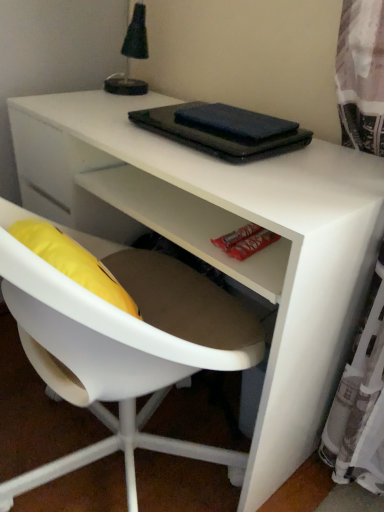
Where is `dark blue matte notebook at upper center, the second notebook positioned from the bottom`? dark blue matte notebook at upper center, the second notebook positioned from the bottom is located at coordinates (234, 123).

Where is `dark blue matte notebook at upper center, which appears as the first notebook when viewed from the top`? The width and height of the screenshot is (384, 512). dark blue matte notebook at upper center, which appears as the first notebook when viewed from the top is located at coordinates (234, 123).

Is dark blue matte notebook at upper center, which appears as the first notebook when viewed from the top, wider or thinner than black fabric lampshade at upper left?

Clearly, dark blue matte notebook at upper center, which appears as the first notebook when viewed from the top, has less width compared to black fabric lampshade at upper left.

From the image's perspective, is dark blue matte notebook at upper center, which appears as the first notebook when viewed from the top, located above black fabric lampshade at upper left?

No, from the image's perspective, dark blue matte notebook at upper center, which appears as the first notebook when viewed from the top, is not above black fabric lampshade at upper left.

Could you tell me if dark blue matte notebook at upper center, which appears as the first notebook when viewed from the top, is turned towards black fabric lampshade at upper left?

No, dark blue matte notebook at upper center, which appears as the first notebook when viewed from the top, is not facing towards black fabric lampshade at upper left.

Is dark blue matte notebook at upper center, the second notebook positioned from the bottom, closer to camera compared to black fabric lampshade at upper left?

Yes.

Which notebook is the 2nd one when counting from the right side of the white plastic chair at center? Please provide its 2D coordinates.

[(234, 123)]

Would you say dark blue matte notebook at upper center, which appears as the first notebook when viewed from the top, is inside or outside white plastic chair at center?

The correct answer is: inside.

Does dark blue matte notebook at upper center, which appears as the first notebook when viewed from the top, have a greater width compared to white plastic chair at center?

Incorrect, the width of dark blue matte notebook at upper center, which appears as the first notebook when viewed from the top, does not surpass that of white plastic chair at center.

Considering the relative sizes of dark blue matte notebook at upper center, which appears as the first notebook when viewed from the top, and white plastic chair at center in the image provided, is dark blue matte notebook at upper center, which appears as the first notebook when viewed from the top, taller than white plastic chair at center?

Incorrect, the height of dark blue matte notebook at upper center, which appears as the first notebook when viewed from the top, is not larger of that of white plastic chair at center.

Between white plastic chair at center and black fabric lampshade at upper left, which one has larger size?

white plastic chair at center.

Can you see white plastic chair at center touching black fabric lampshade at upper left?

They are not placed beside each other.

Which object is closer to the camera, white plastic chair at center or black fabric lampshade at upper left?

white plastic chair at center.

In the image, there is a white plastic chair at center. Identify the location of table lamp above it (from the image's perspective). coord(131,56).

Looking at this image, is white plastic chair at center situated inside black matte notebook at center, the 2th notebook positioned from the top, or outside?

The correct answer is: outside.

From the image's perspective, between white plastic chair at center and black matte notebook at center, which is the first notebook from bottom to top, who is located below?

white plastic chair at center, from the image's perspective.

Is white plastic chair at center facing away from black matte notebook at center, the 2th notebook positioned from the top?

No, white plastic chair at center's orientation is not away from black matte notebook at center, the 2th notebook positioned from the top.

Considering the relative sizes of white plastic chair at center and black matte notebook at center, the 2th notebook positioned from the top, in the image provided, is white plastic chair at center thinner than black matte notebook at center, the 2th notebook positioned from the top,?

Incorrect, the width of white plastic chair at center is not less than that of black matte notebook at center, the 2th notebook positioned from the top.

How many degrees apart are the facing directions of dark blue matte notebook at upper center, the second notebook positioned from the bottom, and black matte notebook at center, the 2th notebook positioned from the top?

0.257 degrees separate the facing orientations of dark blue matte notebook at upper center, the second notebook positioned from the bottom, and black matte notebook at center, the 2th notebook positioned from the top.

From the image's perspective, does dark blue matte notebook at upper center, the second notebook positioned from the bottom, appear lower than black matte notebook at center, which is the first notebook from bottom to top?

Actually, dark blue matte notebook at upper center, the second notebook positioned from the bottom, appears above black matte notebook at center, which is the first notebook from bottom to top, in the image.

Measure the distance from dark blue matte notebook at upper center, the second notebook positioned from the bottom, to black matte notebook at center, the 2th notebook positioned from the top.

dark blue matte notebook at upper center, the second notebook positioned from the bottom, and black matte notebook at center, the 2th notebook positioned from the top, are 1.45 centimeters apart.

Based on their positions, is dark blue matte notebook at upper center, the second notebook positioned from the bottom, located to the left or right of black matte notebook at center, which is the first notebook from bottom to top?

Based on their positions, dark blue matte notebook at upper center, the second notebook positioned from the bottom, is located to the right of black matte notebook at center, which is the first notebook from bottom to top.

Is white plastic chair at center turned away from dark blue matte notebook at upper center, the second notebook positioned from the bottom?

No.

From a real-world perspective, is white plastic chair at center positioned above or below dark blue matte notebook at upper center, which appears as the first notebook when viewed from the top?

From a real-world perspective, white plastic chair at center is physically below dark blue matte notebook at upper center, which appears as the first notebook when viewed from the top.

Considering the relative positions of white plastic chair at center and dark blue matte notebook at upper center, the second notebook positioned from the bottom, in the image provided, is white plastic chair at center behind dark blue matte notebook at upper center, the second notebook positioned from the bottom,?

No.

Is white plastic chair at center to the left or to the right of dark blue matte notebook at upper center, the second notebook positioned from the bottom, in the image?

In the image, white plastic chair at center appears on the left side of dark blue matte notebook at upper center, the second notebook positioned from the bottom.

How many degrees apart are the facing directions of black matte notebook at center, which is the first notebook from bottom to top, and black fabric lampshade at upper left?

There is a 40.9-degree angle between the facing directions of black matte notebook at center, which is the first notebook from bottom to top, and black fabric lampshade at upper left.

Is black matte notebook at center, which is the first notebook from bottom to top, with black fabric lampshade at upper left?

No, black matte notebook at center, which is the first notebook from bottom to top, is not with black fabric lampshade at upper left.

Considering their positions, is black matte notebook at center, which is the first notebook from bottom to top, located in front of or behind black fabric lampshade at upper left?

Clearly, black matte notebook at center, which is the first notebook from bottom to top, is in front of black fabric lampshade at upper left.

Considering the sizes of objects black matte notebook at center, which is the first notebook from bottom to top, and black fabric lampshade at upper left in the image provided, who is smaller, black matte notebook at center, which is the first notebook from bottom to top, or black fabric lampshade at upper left?

black matte notebook at center, which is the first notebook from bottom to top, is smaller.

This screenshot has height=512, width=384. I want to click on notebook that is the 2nd object to the right of the black fabric lampshade at upper left, starting at the anchor, so click(234, 123).

Find the location of a particular element. Image resolution: width=384 pixels, height=512 pixels. chair in front of the dark blue matte notebook at upper center, which appears as the first notebook when viewed from the top is located at coordinates (121, 346).

Which object lies nearer to the anchor point dark blue matte notebook at upper center, the second notebook positioned from the bottom, black matte notebook at center, the 2th notebook positioned from the top, or black fabric lampshade at upper left?

Based on the image, black matte notebook at center, the 2th notebook positioned from the top, appears to be nearer to dark blue matte notebook at upper center, the second notebook positioned from the bottom.

From the image, which object appears to be farther from black matte notebook at center, which is the first notebook from bottom to top, black fabric lampshade at upper left or white plastic chair at center?

The object further to black matte notebook at center, which is the first notebook from bottom to top, is black fabric lampshade at upper left.

From the image, which object appears to be farther from black matte notebook at center, which is the first notebook from bottom to top, dark blue matte notebook at upper center, the second notebook positioned from the bottom, or white plastic chair at center?

Among the two, white plastic chair at center is located further to black matte notebook at center, which is the first notebook from bottom to top.

Looking at the image, which one is located further to dark blue matte notebook at upper center, the second notebook positioned from the bottom, white plastic chair at center or black matte notebook at center, the 2th notebook positioned from the top?

Based on the image, white plastic chair at center appears to be further to dark blue matte notebook at upper center, the second notebook positioned from the bottom.

Estimate the real-world distances between objects in this image. Which object is further from black matte notebook at center, which is the first notebook from bottom to top, black fabric lampshade at upper left or dark blue matte notebook at upper center, the second notebook positioned from the bottom?

black fabric lampshade at upper left lies further to black matte notebook at center, which is the first notebook from bottom to top, than the other object.

Based on their spatial positions, is black matte notebook at center, the 2th notebook positioned from the top, or white plastic chair at center further from black fabric lampshade at upper left?

white plastic chair at center is further to black fabric lampshade at upper left.

Based on their spatial positions, is white plastic chair at center or black matte notebook at center, which is the first notebook from bottom to top, closer to black fabric lampshade at upper left?

The object closer to black fabric lampshade at upper left is black matte notebook at center, which is the first notebook from bottom to top.

Consider the image. Which object lies further to the anchor point white plastic chair at center, black fabric lampshade at upper left or dark blue matte notebook at upper center, which appears as the first notebook when viewed from the top?

black fabric lampshade at upper left is positioned further to the anchor white plastic chair at center.

The height and width of the screenshot is (512, 384). Identify the location of notebook between white plastic chair at center and dark blue matte notebook at upper center, which appears as the first notebook when viewed from the top, along the z-axis. (219, 131).

Where is `notebook located between black matte notebook at center, which is the first notebook from bottom to top, and black fabric lampshade at upper left in the depth direction`? The image size is (384, 512). notebook located between black matte notebook at center, which is the first notebook from bottom to top, and black fabric lampshade at upper left in the depth direction is located at coordinates click(234, 123).